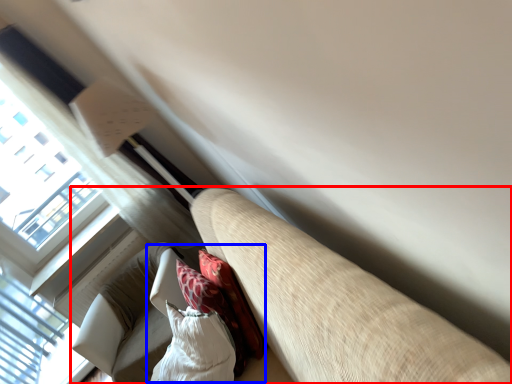
Question: Which of the following is the farthest to the observer, studio couch (highlighted by a red box) or bean bag chair (highlighted by a blue box)?

Choices:
 (A) studio couch
 (B) bean bag chair

Answer: (B)